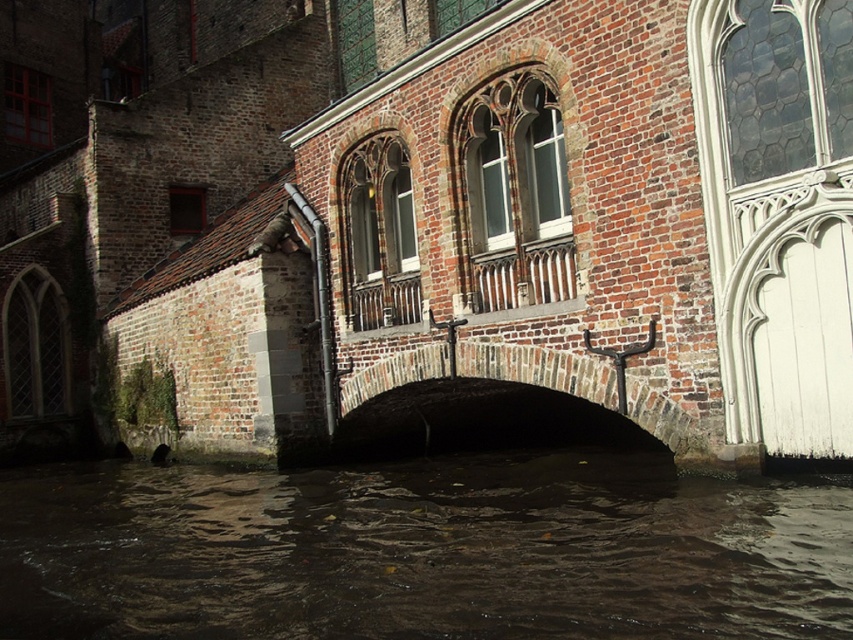
Question: Is brown murky water at center to the left of brick stone bridge at center from the viewer's perspective?

Choices:
 (A) yes
 (B) no

Answer: (A)

Question: Among these points, which one is farthest from the camera?

Choices:
 (A) (483, 388)
 (B) (546, 522)

Answer: (A)

Question: Which point is closer to the camera taking this photo?

Choices:
 (A) (590, 474)
 (B) (564, 364)

Answer: (B)

Question: Which of the following is the closest to the observer?

Choices:
 (A) (196, 596)
 (B) (582, 369)

Answer: (A)

Question: Can you confirm if brown murky water at center is smaller than brick stone bridge at center?

Choices:
 (A) no
 (B) yes

Answer: (A)

Question: Does brown murky water at center have a greater width compared to brick stone bridge at center?

Choices:
 (A) yes
 (B) no

Answer: (A)